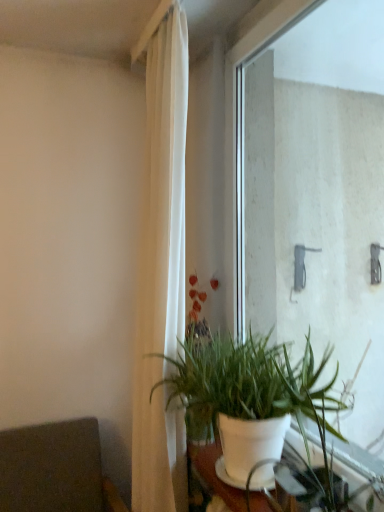
Question: From the image's perspective, is white matte pot at lower center located above or below transparent glass window at center?

Choices:
 (A) below
 (B) above

Answer: (A)

Question: From a real-world perspective, is white matte pot at lower center positioned above or below transparent glass window at center?

Choices:
 (A) below
 (B) above

Answer: (A)

Question: Considering the real-world distances, which object is closest to the white fabric curtain at center?

Choices:
 (A) transparent glass window at center
 (B) dark gray fabric armchair at lower left
 (C) white matte pot at lower center

Answer: (C)

Question: Estimate the real-world distances between objects in this image. Which object is closer to the transparent glass window at center?

Choices:
 (A) dark gray fabric armchair at lower left
 (B) white matte pot at lower center
 (C) white fabric curtain at center

Answer: (B)